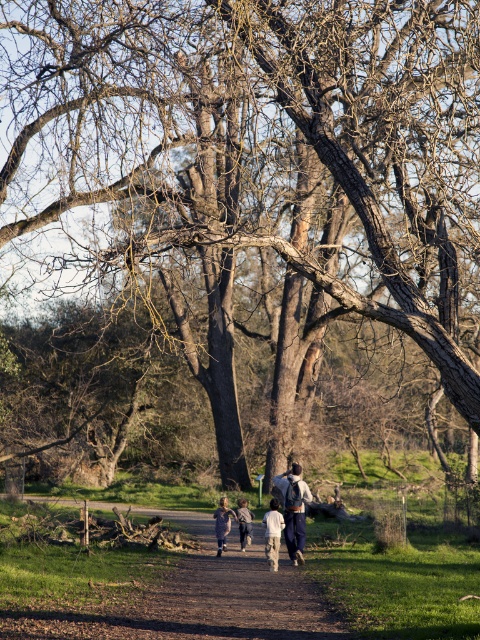
Question: Observing the image, what is the correct spatial positioning of dirt path at center in reference to dark blue jeans at center?

Choices:
 (A) left
 (B) right

Answer: (A)

Question: Which object is the closest to the light brown leather backpack at center?

Choices:
 (A) dirt path at center
 (B) light brown fabric jacket at center
 (C) white cotton shirt at center
 (D) dark blue jeans at center

Answer: (D)

Question: Which point is farther to the camera?

Choices:
 (A) dark blue jeans at center
 (B) light brown leather backpack at center
 (C) dirt path at center
 (D) light brown fabric jacket at center

Answer: (D)

Question: Is light brown leather backpack at center to the right of white cotton shirt at center from the viewer's perspective?

Choices:
 (A) yes
 (B) no

Answer: (A)

Question: Is light brown leather backpack at center positioned behind white cotton shirt at center?

Choices:
 (A) yes
 (B) no

Answer: (A)

Question: Which point is closer to the camera?

Choices:
 (A) (273, 554)
 (B) (276, 566)
 (C) (192, 616)
 (D) (250, 538)

Answer: (C)